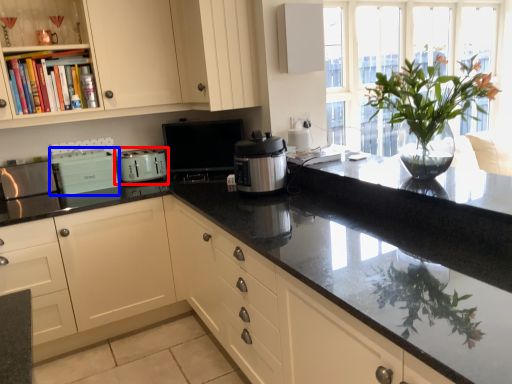
Question: Among these objects, which one is farthest to the camera, kitchen appliance (highlighted by a red box) or appliance (highlighted by a blue box)?

Choices:
 (A) kitchen appliance
 (B) appliance

Answer: (A)